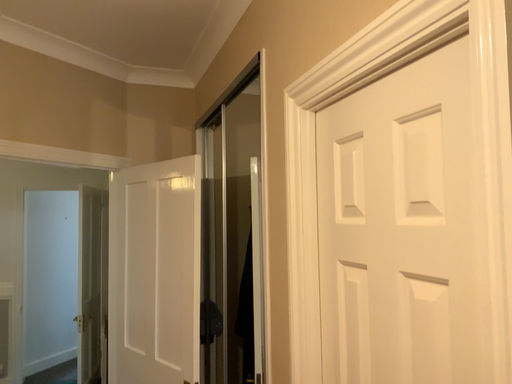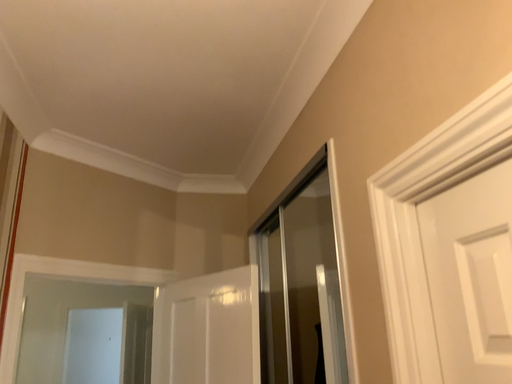
Question: Which way did the camera rotate in the video?

Choices:
 (A) rotated downward
 (B) rotated upward

Answer: (B)